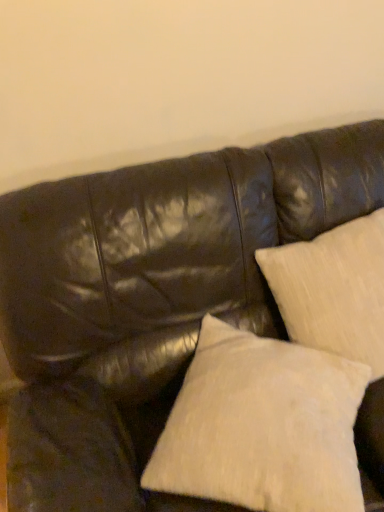
Locate an element on the screen. This screenshot has height=512, width=384. white textured pillow at lower right, which is the second pillow in right-to-left order is located at coordinates (262, 426).

Describe the element at coordinates (262, 426) in the screenshot. The height and width of the screenshot is (512, 384). I see `white textured pillow at lower right, which is the second pillow in right-to-left order` at that location.

How much space does white textured pillow at lower right, the 1th pillow in the left-to-right sequence, occupy vertically?

white textured pillow at lower right, the 1th pillow in the left-to-right sequence, is 19.35 centimeters in height.

Describe the element at coordinates (333, 290) in the screenshot. I see `beige textured pillow at upper right, arranged as the second pillow when viewed from the left` at that location.

Where is `beige textured pillow at upper right, the 1th pillow in the right-to-left sequence`? The width and height of the screenshot is (384, 512). beige textured pillow at upper right, the 1th pillow in the right-to-left sequence is located at coordinates (333, 290).

Identify the location of white textured pillow at lower right, the 1th pillow in the left-to-right sequence. Image resolution: width=384 pixels, height=512 pixels. (262, 426).

Which object is positioned more to the right, beige textured pillow at upper right, arranged as the second pillow when viewed from the left, or white textured pillow at lower right, which is the second pillow in right-to-left order?

beige textured pillow at upper right, arranged as the second pillow when viewed from the left.

Is beige textured pillow at upper right, arranged as the second pillow when viewed from the left, further to the viewer compared to white textured pillow at lower right, which is the second pillow in right-to-left order?

Yes, beige textured pillow at upper right, arranged as the second pillow when viewed from the left, is behind white textured pillow at lower right, which is the second pillow in right-to-left order.

Considering the positions of points (376, 377) and (323, 478), is point (376, 377) farther from camera compared to point (323, 478)?

That is True.

From the image's perspective, would you say beige textured pillow at upper right, arranged as the second pillow when viewed from the left, is shown under white textured pillow at lower right, which is the second pillow in right-to-left order?

No, from the image's perspective, beige textured pillow at upper right, arranged as the second pillow when viewed from the left, is not below white textured pillow at lower right, which is the second pillow in right-to-left order.

From a real-world perspective, relative to white textured pillow at lower right, the 1th pillow in the left-to-right sequence, is beige textured pillow at upper right, the 1th pillow in the right-to-left sequence, vertically above or below?

beige textured pillow at upper right, the 1th pillow in the right-to-left sequence, is above white textured pillow at lower right, the 1th pillow in the left-to-right sequence.

Is beige textured pillow at upper right, the 1th pillow in the right-to-left sequence, wider or thinner than white textured pillow at lower right, the 1th pillow in the left-to-right sequence?

Considering their sizes, beige textured pillow at upper right, the 1th pillow in the right-to-left sequence, looks slimmer than white textured pillow at lower right, the 1th pillow in the left-to-right sequence.

Is beige textured pillow at upper right, arranged as the second pillow when viewed from the left, taller or shorter than white textured pillow at lower right, which is the second pillow in right-to-left order?

beige textured pillow at upper right, arranged as the second pillow when viewed from the left, is taller than white textured pillow at lower right, which is the second pillow in right-to-left order.

Is beige textured pillow at upper right, the 1th pillow in the right-to-left sequence, smaller than white textured pillow at lower right, which is the second pillow in right-to-left order?

Actually, beige textured pillow at upper right, the 1th pillow in the right-to-left sequence, might be larger than white textured pillow at lower right, which is the second pillow in right-to-left order.

Does beige textured pillow at upper right, arranged as the second pillow when viewed from the left, contain white textured pillow at lower right, the 1th pillow in the left-to-right sequence?

That's incorrect, white textured pillow at lower right, the 1th pillow in the left-to-right sequence, is not inside beige textured pillow at upper right, arranged as the second pillow when viewed from the left.

Can you see beige textured pillow at upper right, arranged as the second pillow when viewed from the left, touching white textured pillow at lower right, which is the second pillow in right-to-left order?

No, beige textured pillow at upper right, arranged as the second pillow when viewed from the left, is not in contact with white textured pillow at lower right, which is the second pillow in right-to-left order.

Is white textured pillow at lower right, the 1th pillow in the left-to-right sequence, at the back of beige textured pillow at upper right, arranged as the second pillow when viewed from the left?

No, beige textured pillow at upper right, arranged as the second pillow when viewed from the left,'s orientation is not away from white textured pillow at lower right, the 1th pillow in the left-to-right sequence.

How different are the orientations of beige textured pillow at upper right, arranged as the second pillow when viewed from the left, and white textured pillow at lower right, the 1th pillow in the left-to-right sequence, in degrees?

They differ by 40 degrees in their facing directions.

Find the location of a particular element. Image resolution: width=384 pixels, height=512 pixels. pillow on the right of white textured pillow at lower right, the 1th pillow in the left-to-right sequence is located at coordinates (333, 290).

Which is more to the right, white textured pillow at lower right, the 1th pillow in the left-to-right sequence, or beige textured pillow at upper right, the 1th pillow in the right-to-left sequence?

Positioned to the right is beige textured pillow at upper right, the 1th pillow in the right-to-left sequence.

Consider the image. Considering their positions, is white textured pillow at lower right, which is the second pillow in right-to-left order, located in front of or behind beige textured pillow at upper right, the 1th pillow in the right-to-left sequence?

white textured pillow at lower right, which is the second pillow in right-to-left order, is in front of beige textured pillow at upper right, the 1th pillow in the right-to-left sequence.

Between point (191, 430) and point (346, 243), which one is positioned in front?

The point (191, 430) is closer to the camera.

From the image's perspective, which object appears higher, white textured pillow at lower right, which is the second pillow in right-to-left order, or beige textured pillow at upper right, arranged as the second pillow when viewed from the left?

From the image's view, beige textured pillow at upper right, arranged as the second pillow when viewed from the left, is above.

From a real-world perspective, between white textured pillow at lower right, which is the second pillow in right-to-left order, and beige textured pillow at upper right, arranged as the second pillow when viewed from the left, who is vertically lower?

In real-world perspective, white textured pillow at lower right, which is the second pillow in right-to-left order, is lower.

Considering the sizes of white textured pillow at lower right, which is the second pillow in right-to-left order, and beige textured pillow at upper right, arranged as the second pillow when viewed from the left, in the image, is white textured pillow at lower right, which is the second pillow in right-to-left order, wider or thinner than beige textured pillow at upper right, arranged as the second pillow when viewed from the left,?

In the image, white textured pillow at lower right, which is the second pillow in right-to-left order, appears to be wider than beige textured pillow at upper right, arranged as the second pillow when viewed from the left.

Does white textured pillow at lower right, the 1th pillow in the left-to-right sequence, have a lesser height compared to beige textured pillow at upper right, arranged as the second pillow when viewed from the left?

Indeed, white textured pillow at lower right, the 1th pillow in the left-to-right sequence, has a lesser height compared to beige textured pillow at upper right, arranged as the second pillow when viewed from the left.

Considering the sizes of objects white textured pillow at lower right, which is the second pillow in right-to-left order, and beige textured pillow at upper right, the 1th pillow in the right-to-left sequence, in the image provided, who is bigger, white textured pillow at lower right, which is the second pillow in right-to-left order, or beige textured pillow at upper right, the 1th pillow in the right-to-left sequence,?

With larger size is beige textured pillow at upper right, the 1th pillow in the right-to-left sequence.

Would you say white textured pillow at lower right, which is the second pillow in right-to-left order, contains beige textured pillow at upper right, arranged as the second pillow when viewed from the left?

No, beige textured pillow at upper right, arranged as the second pillow when viewed from the left, is not surrounded by white textured pillow at lower right, which is the second pillow in right-to-left order.

In the scene shown: Can you see white textured pillow at lower right, the 1th pillow in the left-to-right sequence, touching beige textured pillow at upper right, the 1th pillow in the right-to-left sequence?

They are not placed beside each other.

Is white textured pillow at lower right, which is the second pillow in right-to-left order, oriented away from beige textured pillow at upper right, arranged as the second pillow when viewed from the left?

Yes, beige textured pillow at upper right, arranged as the second pillow when viewed from the left, is at the back of white textured pillow at lower right, which is the second pillow in right-to-left order.

Based on the photo, how many degrees apart are the facing directions of white textured pillow at lower right, which is the second pillow in right-to-left order, and beige textured pillow at upper right, the 1th pillow in the right-to-left sequence?

40 degrees separate the facing orientations of white textured pillow at lower right, which is the second pillow in right-to-left order, and beige textured pillow at upper right, the 1th pillow in the right-to-left sequence.

I want to click on pillow directly beneath the beige textured pillow at upper right, arranged as the second pillow when viewed from the left (from a real-world perspective), so coord(262,426).

Find the location of a particular element. This screenshot has width=384, height=512. pillow below the beige textured pillow at upper right, arranged as the second pillow when viewed from the left (from a real-world perspective) is located at coordinates (262, 426).

Where is `pillow above the white textured pillow at lower right, the 1th pillow in the left-to-right sequence (from the image's perspective)`? The height and width of the screenshot is (512, 384). pillow above the white textured pillow at lower right, the 1th pillow in the left-to-right sequence (from the image's perspective) is located at coordinates (333, 290).